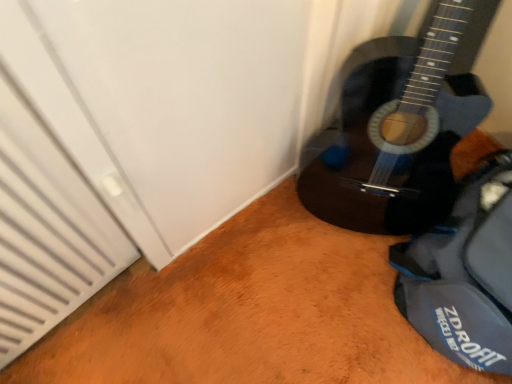
Describe the element at coordinates (464, 275) in the screenshot. The height and width of the screenshot is (384, 512). I see `blue fabric messenger bag at lower right` at that location.

I want to click on blue fabric messenger bag at lower right, so click(x=464, y=275).

Locate an element on the screen. The width and height of the screenshot is (512, 384). glossy dark wood guitar at lower right is located at coordinates (399, 130).

What is the approximate width of glossy dark wood guitar at lower right?

16.90 inches.

Describe the element at coordinates (399, 130) in the screenshot. The height and width of the screenshot is (384, 512). I see `glossy dark wood guitar at lower right` at that location.

Where is `blue fabric messenger bag at lower right`? This screenshot has width=512, height=384. blue fabric messenger bag at lower right is located at coordinates (464, 275).

Is glossy dark wood guitar at lower right to the left of blue fabric messenger bag at lower right from the viewer's perspective?

Correct, you'll find glossy dark wood guitar at lower right to the left of blue fabric messenger bag at lower right.

Is glossy dark wood guitar at lower right in front of or behind blue fabric messenger bag at lower right in the image?

Visually, glossy dark wood guitar at lower right is located in front of blue fabric messenger bag at lower right.

Considering the points (316, 188) and (448, 231), which point is in front, point (316, 188) or point (448, 231)?

The point (448, 231) is more forward.

From the image's perspective, which is below, glossy dark wood guitar at lower right or blue fabric messenger bag at lower right?

From the image's view, blue fabric messenger bag at lower right is below.

From a real-world perspective, is glossy dark wood guitar at lower right physically above blue fabric messenger bag at lower right?

Yes.

Considering the sizes of objects glossy dark wood guitar at lower right and blue fabric messenger bag at lower right in the image provided, who is wider, glossy dark wood guitar at lower right or blue fabric messenger bag at lower right?

With larger width is blue fabric messenger bag at lower right.

Is glossy dark wood guitar at lower right taller or shorter than blue fabric messenger bag at lower right?

Clearly, glossy dark wood guitar at lower right is taller compared to blue fabric messenger bag at lower right.

Between glossy dark wood guitar at lower right and blue fabric messenger bag at lower right, which one has smaller size?

blue fabric messenger bag at lower right is smaller.

Is blue fabric messenger bag at lower right a part of glossy dark wood guitar at lower right?

No, blue fabric messenger bag at lower right is located outside of glossy dark wood guitar at lower right.

Is glossy dark wood guitar at lower right far away from blue fabric messenger bag at lower right?

glossy dark wood guitar at lower right is actually quite close to blue fabric messenger bag at lower right.

Is blue fabric messenger bag at lower right at the back of glossy dark wood guitar at lower right?

No.

You are a GUI agent. You are given a task and a screenshot of the screen. Output one action in this format:
    pyautogui.click(x=<x>, y=<y>)
    Task: Click on the guitar above the blue fabric messenger bag at lower right (from the image's perspective)
    This screenshot has height=384, width=512.
    Given the screenshot: What is the action you would take?
    pyautogui.click(x=399, y=130)

Consider the image. Is blue fabric messenger bag at lower right at the left side of glossy dark wood guitar at lower right?

Incorrect, blue fabric messenger bag at lower right is not on the left side of glossy dark wood guitar at lower right.

Considering the relative positions of blue fabric messenger bag at lower right and glossy dark wood guitar at lower right in the image provided, is blue fabric messenger bag at lower right behind glossy dark wood guitar at lower right?

Yes, it is behind glossy dark wood guitar at lower right.

Between point (425, 338) and point (418, 118), which one is positioned behind?

Point (425, 338)

From the image's perspective, is blue fabric messenger bag at lower right above or below glossy dark wood guitar at lower right?

Clearly, from the image's perspective, blue fabric messenger bag at lower right is below glossy dark wood guitar at lower right.

From a real-world perspective, between blue fabric messenger bag at lower right and glossy dark wood guitar at lower right, who is vertically higher?

glossy dark wood guitar at lower right, from a real-world perspective.

Which of these two, blue fabric messenger bag at lower right or glossy dark wood guitar at lower right, is wider?

blue fabric messenger bag at lower right.

Is blue fabric messenger bag at lower right taller or shorter than glossy dark wood guitar at lower right?

Considering their sizes, blue fabric messenger bag at lower right has less height than glossy dark wood guitar at lower right.

Which of these two, blue fabric messenger bag at lower right or glossy dark wood guitar at lower right, is bigger?

With larger size is glossy dark wood guitar at lower right.

Choose the correct answer: Is blue fabric messenger bag at lower right inside glossy dark wood guitar at lower right or outside it?

blue fabric messenger bag at lower right is not enclosed by glossy dark wood guitar at lower right.

Are blue fabric messenger bag at lower right and glossy dark wood guitar at lower right located far from each other?

No, blue fabric messenger bag at lower right is in close proximity to glossy dark wood guitar at lower right.

Is blue fabric messenger bag at lower right oriented away from glossy dark wood guitar at lower right?

No, blue fabric messenger bag at lower right is not facing away from glossy dark wood guitar at lower right.

You are a GUI agent. You are given a task and a screenshot of the screen. Output one action in this format:
    pyautogui.click(x=<x>, y=<y>)
    Task: Click on the messenger bag located below the glossy dark wood guitar at lower right (from the image's perspective)
    
    Given the screenshot: What is the action you would take?
    pyautogui.click(x=464, y=275)

I want to click on messenger bag lying on the right of glossy dark wood guitar at lower right, so click(464, 275).

What are the coordinates of `guitar lying in front of the blue fabric messenger bag at lower right` in the screenshot? It's located at (399, 130).